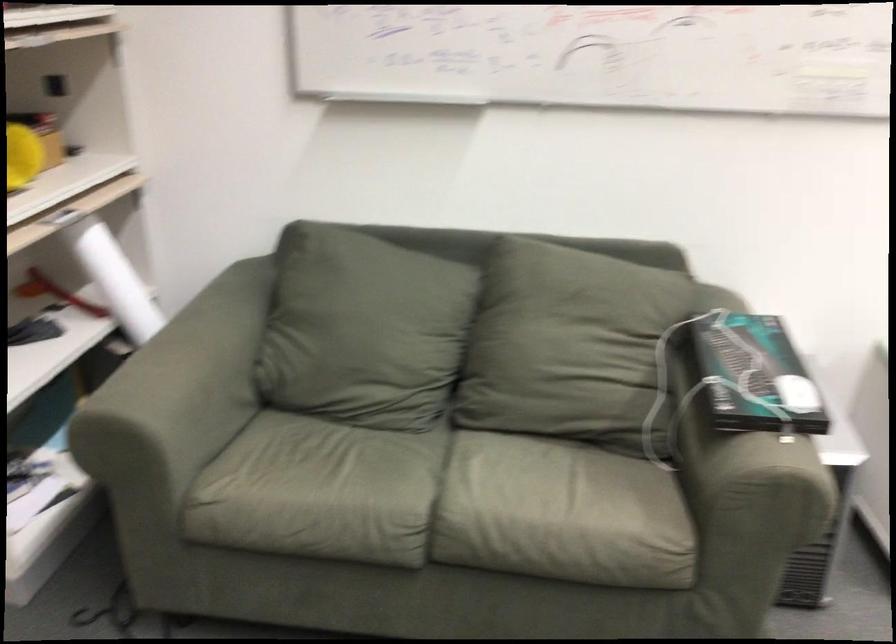
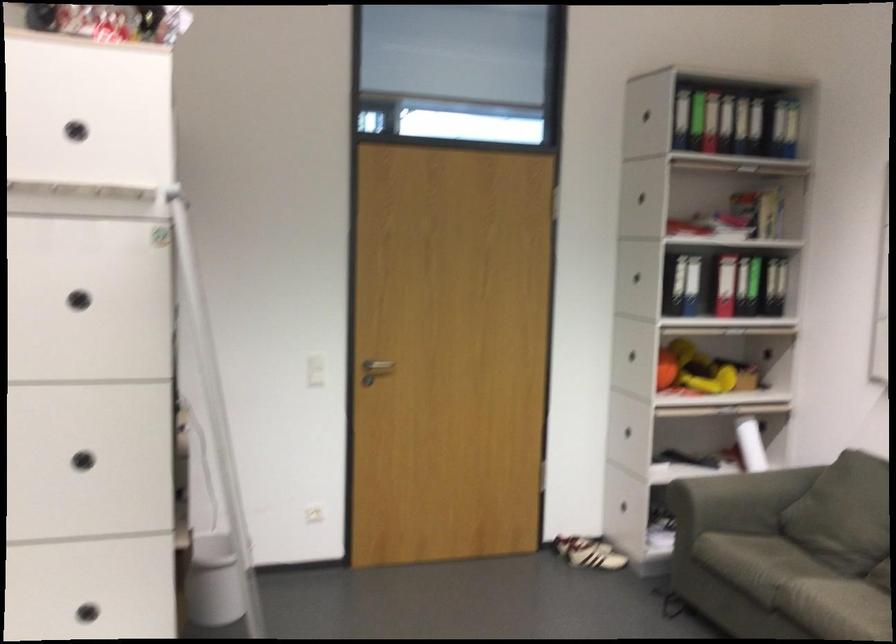
Find the pixel in the second image that matches point 410,562 in the first image.

(771, 623)